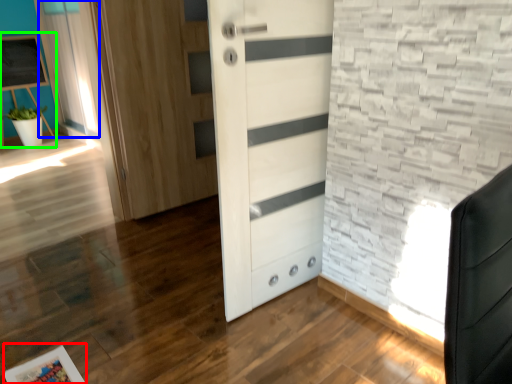
Question: Which is farther away from picture frame (highlighted by a red box)? curtain (highlighted by a blue box) or bulletin board (highlighted by a green box)?

Choices:
 (A) curtain
 (B) bulletin board

Answer: (B)